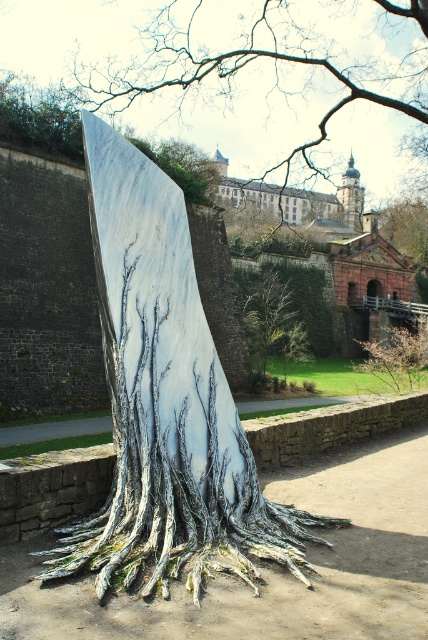
Which is behind, point (184, 400) or point (249, 284)?

Positioned behind is point (249, 284).

Where is `white marble tree trunk at center`? Image resolution: width=428 pixels, height=640 pixels. white marble tree trunk at center is located at coordinates (166, 403).

Is point (124, 307) farther from viewer compared to point (264, 364)?

That is False.

Where is `white marble tree trunk at center`? This screenshot has width=428, height=640. white marble tree trunk at center is located at coordinates (166, 403).

Can you confirm if white marble tree at center is positioned to the right of smooth bark tree at center?

In fact, white marble tree at center is to the left of smooth bark tree at center.

Is white marble tree at center in front of smooth bark tree at center?

That is True.

Based on the photo, measure the distance between white marble tree at center and camera.

white marble tree at center and camera are 16.38 meters apart from each other.

This screenshot has width=428, height=640. In order to click on white marble tree at center in this screenshot , I will do `click(275, 60)`.

Does white marble tree at center have a lesser width compared to green leafy tree at center?

In fact, white marble tree at center might be wider than green leafy tree at center.

Is white marble tree at center shorter than green leafy tree at center?

Incorrect, white marble tree at center's height does not fall short of green leafy tree at center's.

The image size is (428, 640). Describe the element at coordinates (275, 60) in the screenshot. I see `white marble tree at center` at that location.

Locate an element on the screen. Image resolution: width=428 pixels, height=640 pixels. white marble tree at center is located at coordinates (275, 60).